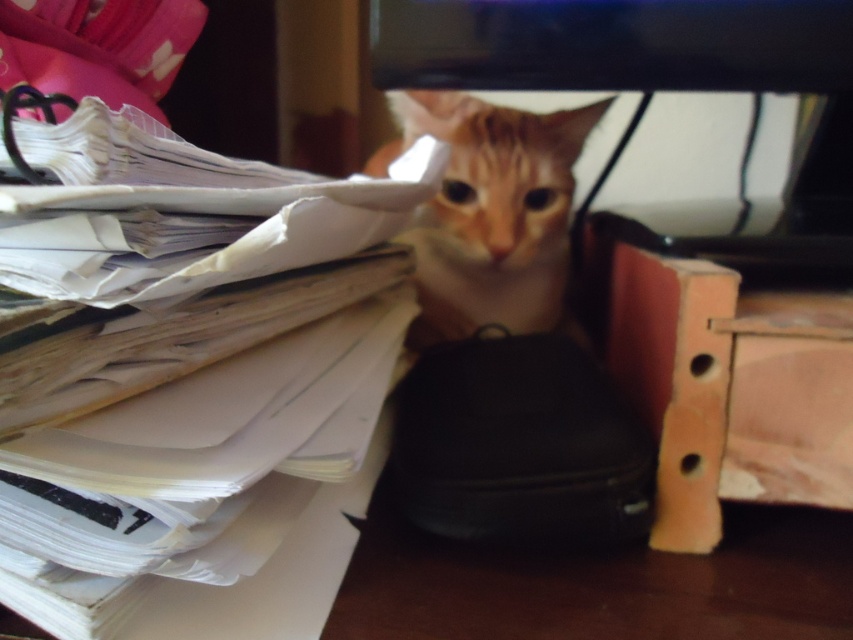
You are working at a desk and notice the white paper at left and the orange fur cat at center. Which object is closer to you?

The white paper at left is closer to you because it is in front of the orange fur cat at center.

You are organizing the desk and need to place a new item between the white paper at left and the black matte bag at center. Based on their positions, where should the new item be placed?

The white paper at left is closer to the viewer than the black matte bag at center, so the new item should be placed between them, closer to the black matte bag at center to maintain the spatial order.

You are organizing items on a desk and need to place a new item exactly at point (518,444). Which object is already occupying that location?

The black matte bag at center is located at point (518,444), so it is occupying that location.